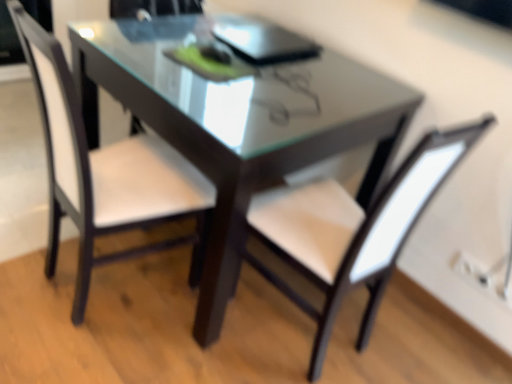
Question: Relative to white leather chair at center, the second chair from the right, is transparent glass table at center in front or behind?

Choices:
 (A) front
 (B) behind

Answer: (B)

Question: From the image's perspective, relative to white leather chair at center, the second chair from the right, is transparent glass table at center above or below?

Choices:
 (A) below
 (B) above

Answer: (B)

Question: Which is nearer to the white leather chair at center, marked as the 2th chair in a left-to-right arrangement?

Choices:
 (A) transparent glass table at center
 (B) white leather chair at center, the second chair from the right

Answer: (A)

Question: Which of these objects is positioned farthest from the white leather chair at center, marked as the first chair in a right-to-left arrangement?

Choices:
 (A) white leather chair at center, the second chair from the right
 (B) transparent glass table at center

Answer: (A)